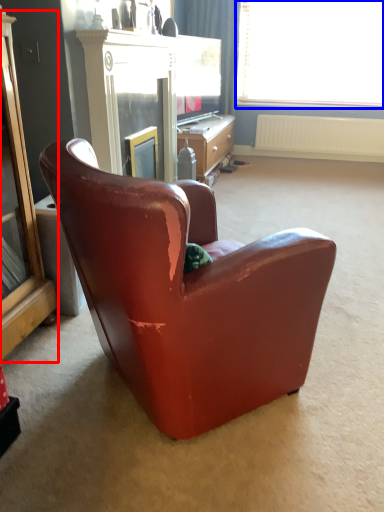
Question: Which point is closer to the camera, cabinetry (highlighted by a red box) or window (highlighted by a blue box)?

Choices:
 (A) cabinetry
 (B) window

Answer: (A)